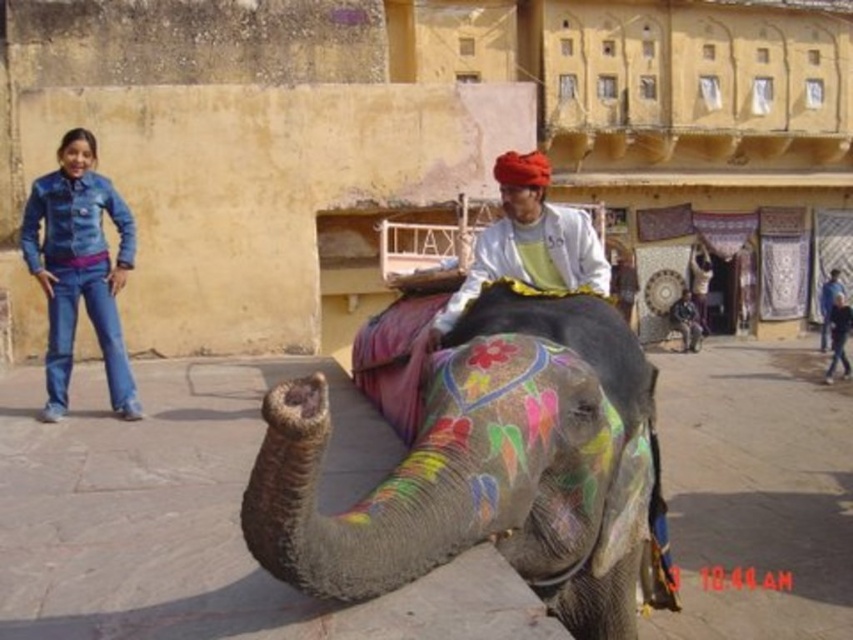
Who is positioned more to the left, denim jeans at left or matte white shirt at center?

Positioned to the left is denim jeans at left.

Between denim jeans at left and matte white shirt at center, which one appears on the right side from the viewer's perspective?

From the viewer's perspective, matte white shirt at center appears more on the right side.

Is point (73, 180) in front of point (576, 220)?

No, it is behind (576, 220).

Where is `denim jeans at left`? The image size is (853, 640). denim jeans at left is located at coordinates (79, 268).

Can you confirm if painted fabric elephant at center is positioned to the left of matte white shirt at center?

Indeed, painted fabric elephant at center is positioned on the left side of matte white shirt at center.

Which is above, painted fabric elephant at center or matte white shirt at center?

matte white shirt at center

Where is `painted fabric elephant at center`? painted fabric elephant at center is located at coordinates (489, 468).

You are a GUI agent. You are given a task and a screenshot of the screen. Output one action in this format:
    pyautogui.click(x=<x>, y=<y>)
    Task: Click on the painted fabric elephant at center
    The height and width of the screenshot is (640, 853).
    Given the screenshot: What is the action you would take?
    pyautogui.click(x=489, y=468)

Who is shorter, painted fabric elephant at center or denim jeans at left?

Standing shorter between the two is painted fabric elephant at center.

Between point (648, 465) and point (88, 208), which one is positioned behind?

The point (88, 208) is more distant.

The image size is (853, 640). In order to click on painted fabric elephant at center in this screenshot , I will do `click(489, 468)`.